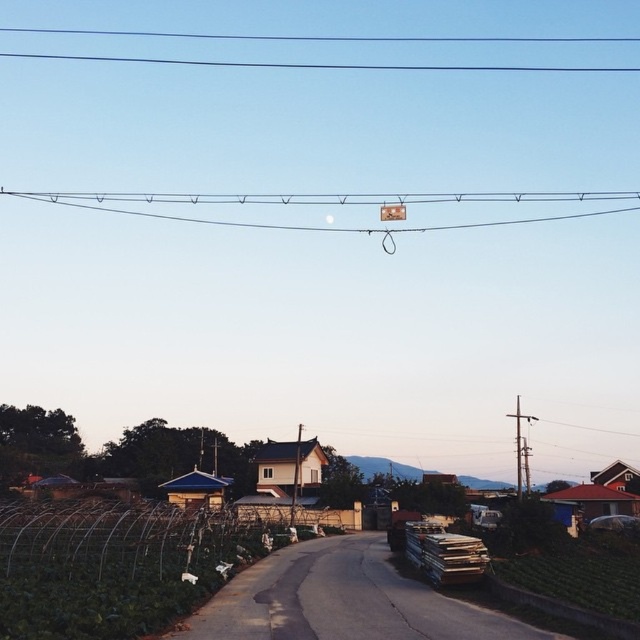
You are driving a metallic silver car at right and want to read the metallic rectangular sign at upper center. Can you see the sign from your current position?

The metallic silver car at right is below the metallic rectangular sign at upper center, so yes, you can see the sign from your current position as it is above the car.

In the scene shown: You are a farmer checking the irrigation system. You notice the black wire at upper center and the metallic gray pole at right. Which object is closer to you from your current position?

The black wire at upper center is closer to you because the metallic gray pole at right is behind it.